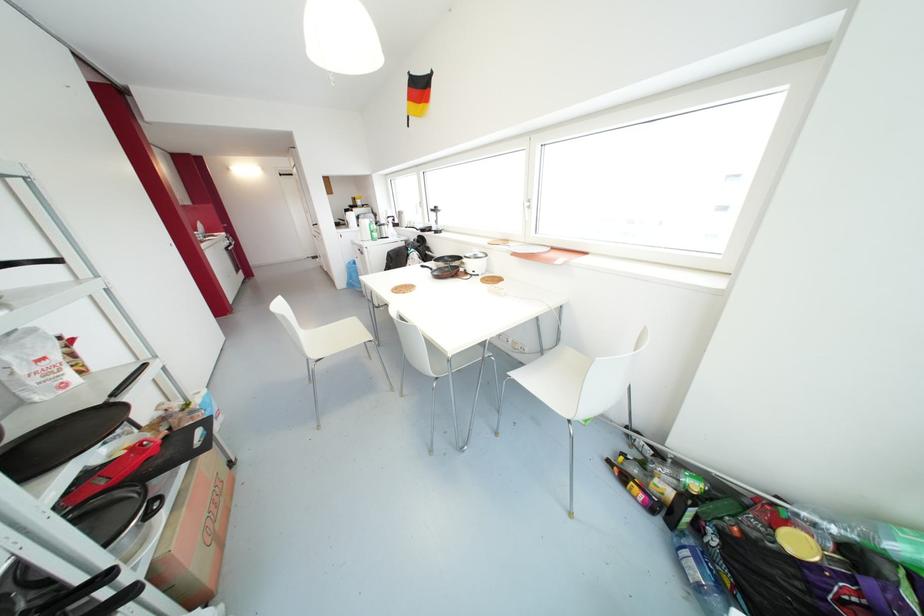
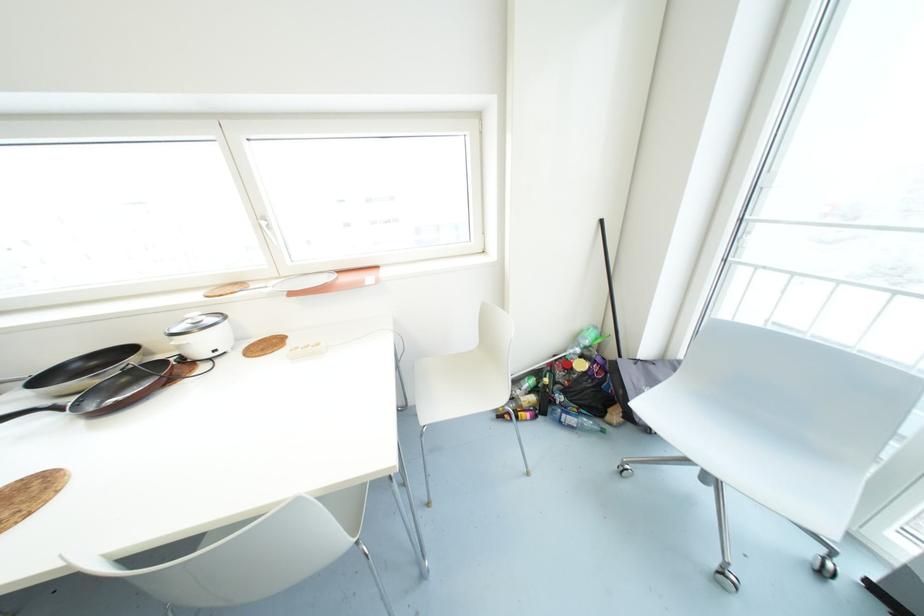
Question: The first image is from the beginning of the video and the second image is from the end. How did the camera likely rotate when shooting the video?

Choices:
 (A) Left
 (B) Right
 (C) Up
 (D) Down

Answer: (B)